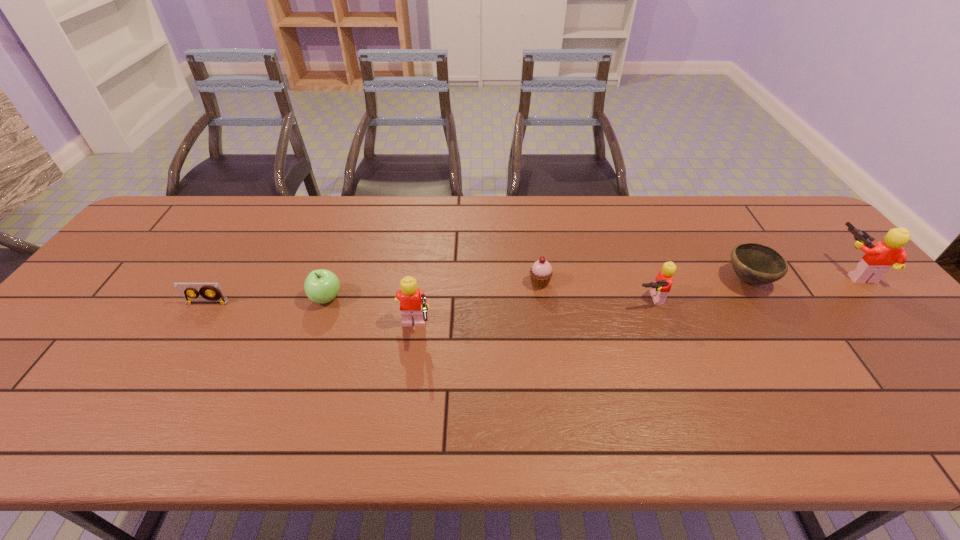
Image resolution: width=960 pixels, height=540 pixels. Identify the location of vacant space that satisfies the following two spatial constraints: 1. on the front side of the cupcake; 2. in front of the leftmost Lego with the accessory visible. (546, 330).

At what (x,y) coordinates should I click in order to perform the action: click on vacant region that satisfies the following two spatial constraints: 1. in front of the second Lego from left to right with the accessory visible; 2. in front of the second tallest object with the accessory visible. Please return your answer as a coordinate pair (x, y). The width and height of the screenshot is (960, 540). Looking at the image, I should click on (660, 330).